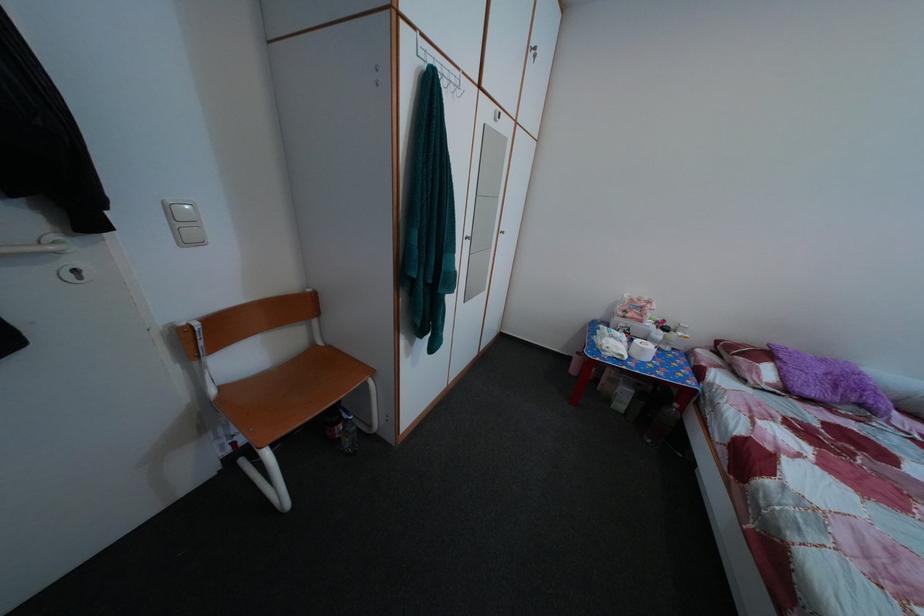
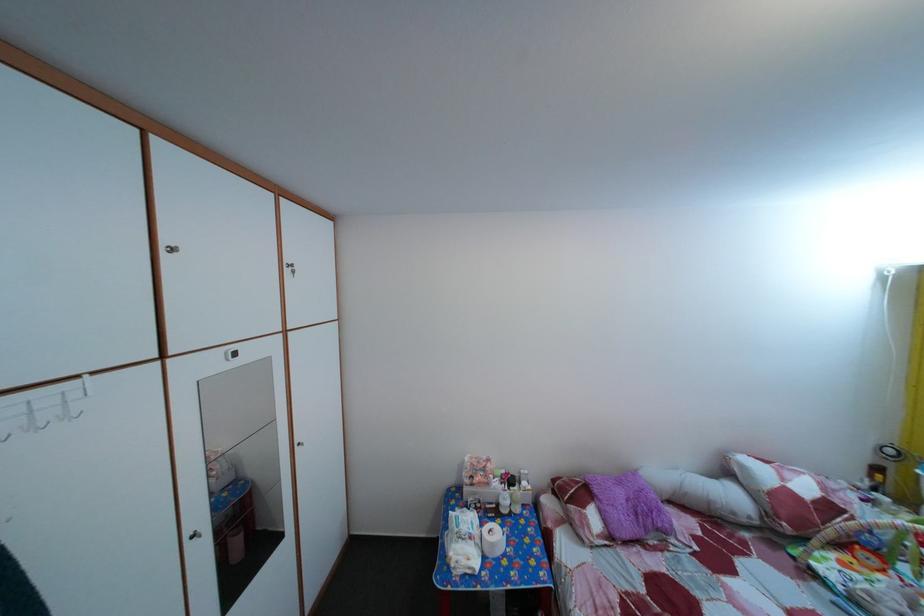
Find the pixel in the second image that matches (832,369) in the first image.

(629, 491)